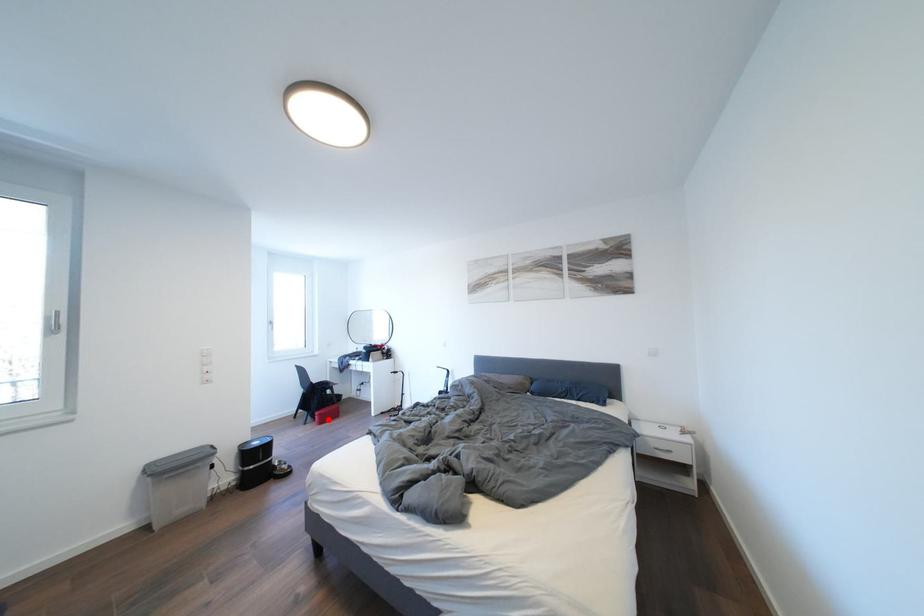
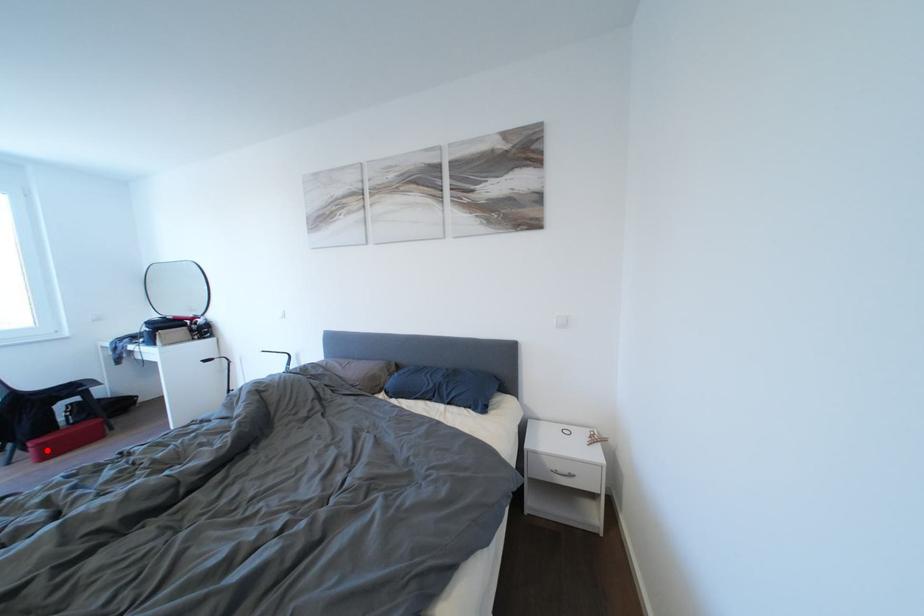
I am providing you with two images of the same scene from different viewpoints. A red point is marked on the first image and another point is marked on the second image. Does the point marked in image1 correspond to the same location as the one in image2?

Yes